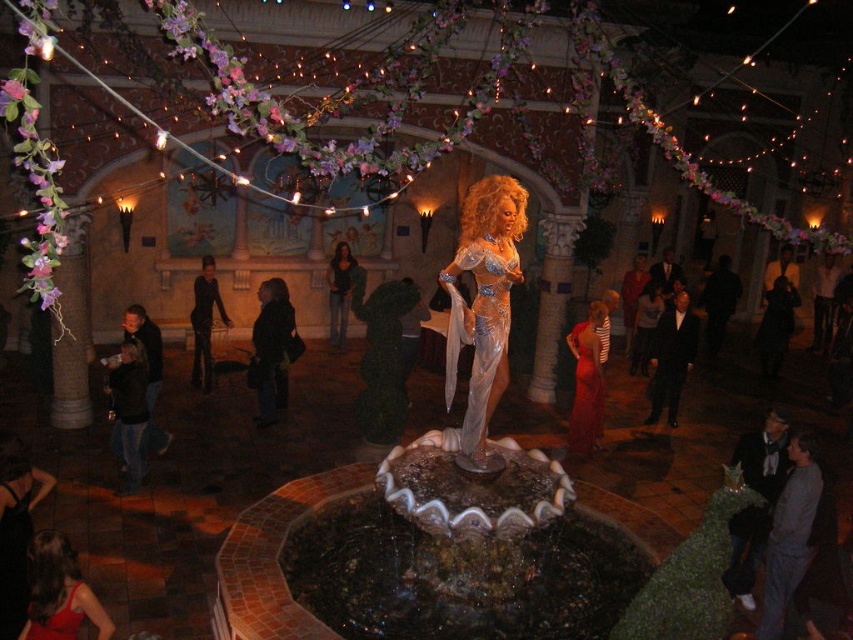
You are a photographer positioned at the back of the venue. You want to capture a clear photo of the performer wearing the translucent silver dress at center and the shiny red dress at center. Which dress will appear larger in your photo?

The translucent silver dress at center will appear larger in the photo because it is closer to the viewer than the shiny red dress at center.

You are a photographer trying to capture both the translucent silver dress at center and the shiny red dress at center in the same frame. Based on their sizes, which dress should you focus on to ensure both fit comfortably in the photo?

The translucent silver dress at center might be wider than the shiny red dress at center, so focusing on the wider translucent silver dress at center would help ensure both dresses fit comfortably in the photo.